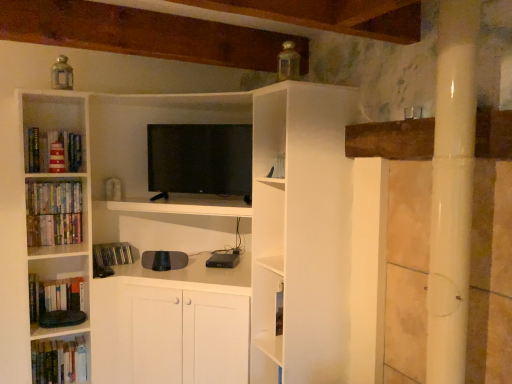
Question: From a real-world perspective, is hardcover books at left, the 3th book from the top, on top of hardcover books at left, the first book ordered from the bottom?

Choices:
 (A) no
 (B) yes

Answer: (B)

Question: Is hardcover books at left, the 3th book from the top, behind hardcover books at left, the first book ordered from the bottom?

Choices:
 (A) no
 (B) yes

Answer: (A)

Question: Can you confirm if hardcover books at left, the 3th book from the top, is smaller than hardcover books at left, the first book ordered from the bottom?

Choices:
 (A) no
 (B) yes

Answer: (B)

Question: Is the surface of hardcover books at left, the 3th book from the top, in direct contact with hardcover books at left, the 6th book positioned from the top?

Choices:
 (A) yes
 (B) no

Answer: (B)

Question: Could hardcover books at left, the 6th book positioned from the top, be considered to be inside hardcover books at left, the fourth book ordered from the bottom?

Choices:
 (A) no
 (B) yes

Answer: (A)

Question: Is hardcover books at left, the 6th book positioned from the top, taller or shorter than hardcover books at left, the fourth book ordered from the bottom?

Choices:
 (A) short
 (B) tall

Answer: (B)

Question: From a real-world perspective, is hardcover books at left, the 6th book positioned from the top, positioned above or below hardcover books at left, the fourth book ordered from the bottom?

Choices:
 (A) below
 (B) above

Answer: (A)

Question: Considering the positions of hardcover books at left, the first book ordered from the bottom, and hardcover books at left, the 3th book from the top, in the image, is hardcover books at left, the first book ordered from the bottom, wider or thinner than hardcover books at left, the 3th book from the top,?

Choices:
 (A) thin
 (B) wide

Answer: (B)

Question: Is hardcover books at left, the 6th book positioned from the top, spatially inside hardcover books at left, the fourth book ordered from the bottom, or outside of it?

Choices:
 (A) inside
 (B) outside

Answer: (B)

Question: From their relative heights in the image, would you say hardcover books at left, which appears as the second book when viewed from the top, is taller or shorter than hardcover books at left, the 6th book positioned from the top?

Choices:
 (A) short
 (B) tall

Answer: (A)

Question: Considering the relative positions of hardcover books at left, which appears as the second book when viewed from the top, and hardcover books at left, the first book ordered from the bottom, in the image provided, is hardcover books at left, which appears as the second book when viewed from the top, to the left or to the right of hardcover books at left, the first book ordered from the bottom,?

Choices:
 (A) right
 (B) left

Answer: (A)

Question: Considering the positions of point (40, 200) and point (75, 364), is point (40, 200) closer or farther from the camera than point (75, 364)?

Choices:
 (A) closer
 (B) farther

Answer: (A)

Question: In terms of width, does hardcover books at left, which is counted as the 5th book, starting from the bottom, look wider or thinner when compared to hardcover books at left, the first book ordered from the bottom?

Choices:
 (A) wide
 (B) thin

Answer: (B)

Question: Relative to hardcover books at left, which appears as the second book when viewed from the top, is hardcover books at lower left, which is the 2th book from bottom to top, in front or behind?

Choices:
 (A) front
 (B) behind

Answer: (A)

Question: In terms of height, does hardcover books at lower left, which ranks as the 5th book in top-to-bottom order, look taller or shorter compared to hardcover books at left, which appears as the second book when viewed from the top?

Choices:
 (A) tall
 (B) short

Answer: (A)